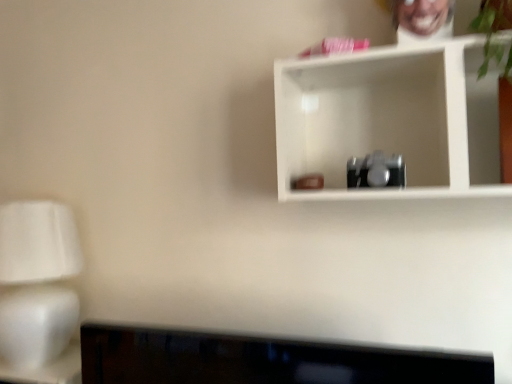
Question: Does white matte shelf at upper center lie in front of white matte table lamp at left?

Choices:
 (A) no
 (B) yes

Answer: (B)

Question: Does white matte shelf at upper center appear on the left side of white matte table lamp at left?

Choices:
 (A) no
 (B) yes

Answer: (A)

Question: From a real-world perspective, is white matte shelf at upper center located beneath white matte table lamp at left?

Choices:
 (A) no
 (B) yes

Answer: (A)

Question: Is white matte shelf at upper center next to white matte table lamp at left?

Choices:
 (A) yes
 (B) no

Answer: (B)

Question: Is white matte shelf at upper center wider than white matte table lamp at left?

Choices:
 (A) yes
 (B) no

Answer: (B)

Question: From the image's perspective, is white matte shelf at upper center beneath white matte table lamp at left?

Choices:
 (A) no
 (B) yes

Answer: (A)

Question: Is white matte table lamp at left at the left side of white matte shelf at upper center?

Choices:
 (A) no
 (B) yes

Answer: (B)

Question: Considering the relative sizes of white matte table lamp at left and white matte shelf at upper center in the image provided, is white matte table lamp at left wider than white matte shelf at upper center?

Choices:
 (A) yes
 (B) no

Answer: (A)

Question: Is white matte table lamp at left next to white matte shelf at upper center and touching it?

Choices:
 (A) yes
 (B) no

Answer: (B)

Question: Can you confirm if white matte table lamp at left is positioned to the right of white matte shelf at upper center?

Choices:
 (A) no
 (B) yes

Answer: (A)

Question: From the image's perspective, is white matte table lamp at left on white matte shelf at upper center?

Choices:
 (A) yes
 (B) no

Answer: (B)

Question: Is there a large distance between white matte table lamp at left and white matte shelf at upper center?

Choices:
 (A) no
 (B) yes

Answer: (A)

Question: Is white matte shelf at upper center inside the boundaries of white matte table lamp at left, or outside?

Choices:
 (A) inside
 (B) outside

Answer: (B)